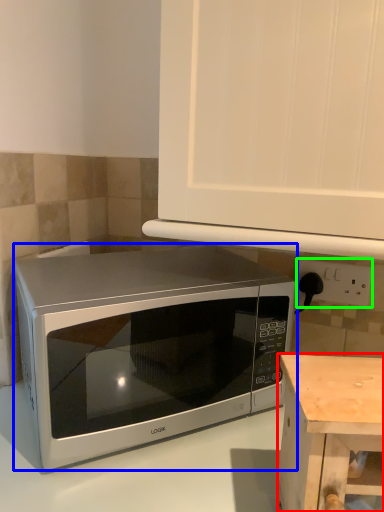
Question: Based on their relative distances, which object is farther from table (highlighted by a red box)? Choose from microwave oven (highlighted by a blue box) and electric outlet (highlighted by a green box).

Choices:
 (A) microwave oven
 (B) electric outlet

Answer: (B)